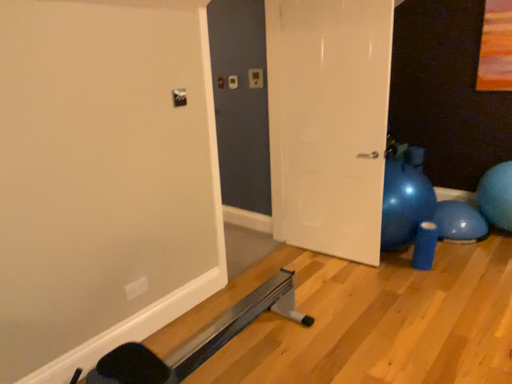
What do you see at coordinates (328, 122) in the screenshot? I see `white glossy door at center` at bounding box center [328, 122].

The image size is (512, 384). I want to click on white glossy door at center, so click(328, 122).

The height and width of the screenshot is (384, 512). Find the location of `blue rubber ball at right`. blue rubber ball at right is located at coordinates (496, 196).

This screenshot has width=512, height=384. What do you see at coordinates (496, 196) in the screenshot? I see `blue rubber ball at right` at bounding box center [496, 196].

Where is `white glossy door at center`? white glossy door at center is located at coordinates (328, 122).

Considering the relative positions of white glossy door at center and blue rubber ball at right in the image provided, is white glossy door at center to the left or to the right of blue rubber ball at right?

From the image, it's evident that white glossy door at center is to the left of blue rubber ball at right.

Relative to blue rubber ball at right, is white glossy door at center in front or behind?

Clearly, white glossy door at center is in front of blue rubber ball at right.

Considering the points (341, 82) and (478, 201), which point is behind, point (341, 82) or point (478, 201)?

The point (478, 201) is more distant.

From the image's perspective, which object appears higher, white glossy door at center or blue rubber ball at right?

white glossy door at center is shown above in the image.

Consider the image. From a real-world perspective, does white glossy door at center stand above blue rubber ball at right?

Yes, from a real-world perspective, white glossy door at center is on top of blue rubber ball at right.

In terms of width, does white glossy door at center look wider or thinner when compared to blue rubber ball at right?

Clearly, white glossy door at center has less width compared to blue rubber ball at right.

Looking at this image, which of these two, white glossy door at center or blue rubber ball at right, stands shorter?

blue rubber ball at right is shorter.

Consider the image. Looking at the image, does white glossy door at center seem bigger or smaller compared to blue rubber ball at right?

In the image, white glossy door at center appears to be larger than blue rubber ball at right.

Is white glossy door at center completely or partially outside of blue rubber ball at right?

Indeed, white glossy door at center is completely outside blue rubber ball at right.

Is white glossy door at center beside blue rubber ball at right?

white glossy door at center is not next to blue rubber ball at right, and they're not touching.

Does white glossy door at center turn towards blue rubber ball at right?

No, white glossy door at center is not oriented towards blue rubber ball at right.

Locate an element on the screen. ball behind the white glossy door at center is located at coordinates tap(496, 196).

Considering the positions of objects blue rubber ball at right and white glossy door at center in the image provided, who is more to the right, blue rubber ball at right or white glossy door at center?

From the viewer's perspective, blue rubber ball at right appears more on the right side.

Is blue rubber ball at right in front of or behind white glossy door at center in the image?

Visually, blue rubber ball at right is located behind white glossy door at center.

Which is in front, point (494, 215) or point (301, 203)?

Positioned in front is point (301, 203).

From the image's perspective, is blue rubber ball at right positioned above or below white glossy door at center?

blue rubber ball at right is below white glossy door at center.

From a real-world perspective, relative to white glossy door at center, is blue rubber ball at right vertically above or below?

In terms of real-world spatial position, blue rubber ball at right is below white glossy door at center.

Between blue rubber ball at right and white glossy door at center, which one has larger width?

Wider between the two is blue rubber ball at right.

Between blue rubber ball at right and white glossy door at center, which one has more height?

white glossy door at center is taller.

In terms of size, does blue rubber ball at right appear bigger or smaller than white glossy door at center?

Clearly, blue rubber ball at right is smaller in size than white glossy door at center.

Is blue rubber ball at right outside of white glossy door at center?

Yes, blue rubber ball at right is outside of white glossy door at center.

Would you consider blue rubber ball at right to be distant from white glossy door at center?

Indeed, blue rubber ball at right is not near white glossy door at center.

Could you tell me if blue rubber ball at right is facing white glossy door at center?

No, blue rubber ball at right is not oriented towards white glossy door at center.

Identify the location of door on the left of blue rubber ball at right. (328, 122).

Image resolution: width=512 pixels, height=384 pixels. In the image, there is a blue rubber ball at right. Find the location of `door above it (from the image's perspective)`. door above it (from the image's perspective) is located at coordinates click(328, 122).

Find the location of a particular element. The width and height of the screenshot is (512, 384). door above the blue rubber ball at right (from a real-world perspective) is located at coordinates (328, 122).